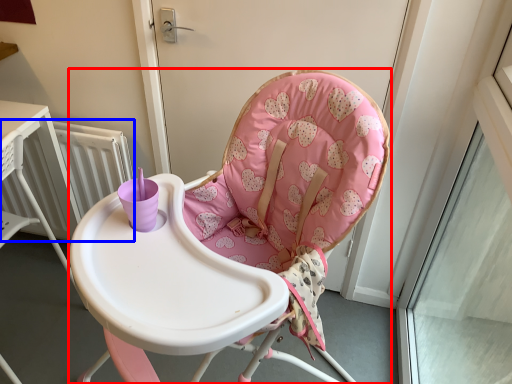
Question: Which of the following is the closest to the observer, chair (highlighted by a red box) or radiator (highlighted by a blue box)?

Choices:
 (A) chair
 (B) radiator

Answer: (A)